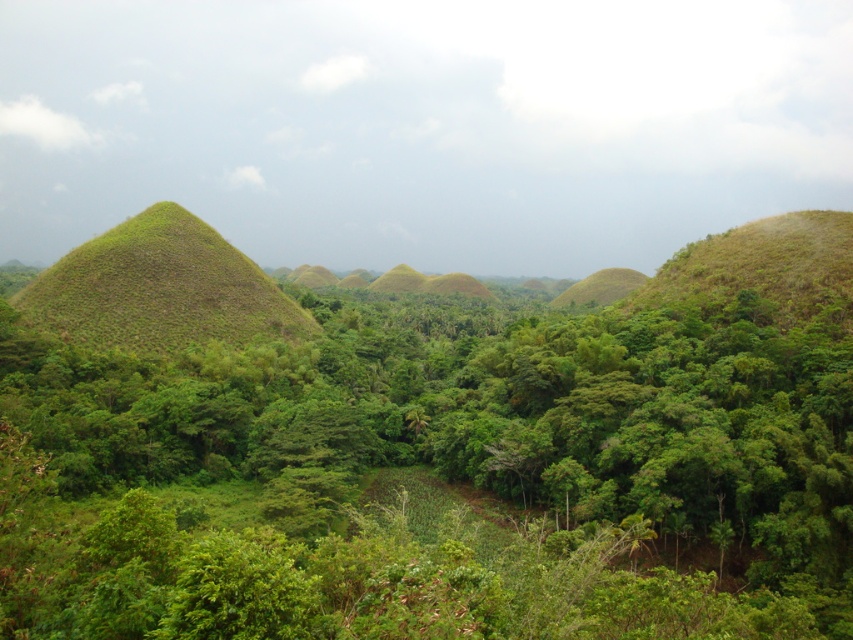
Question: From the image, what is the correct spatial relationship of green leafy tree at center in relation to green grassy hill at left?

Choices:
 (A) below
 (B) above

Answer: (A)

Question: Which object is closer to the camera taking this photo?

Choices:
 (A) green grassy hill at left
 (B) green leafy tree at center

Answer: (B)

Question: Is green leafy tree at center to the right of green grassy hill at left from the viewer's perspective?

Choices:
 (A) no
 (B) yes

Answer: (B)

Question: Which point is farther from the camera taking this photo?

Choices:
 (A) (672, 515)
 (B) (167, 278)

Answer: (B)

Question: Can you confirm if green leafy tree at center is positioned above green grassy hill at left?

Choices:
 (A) yes
 (B) no

Answer: (B)